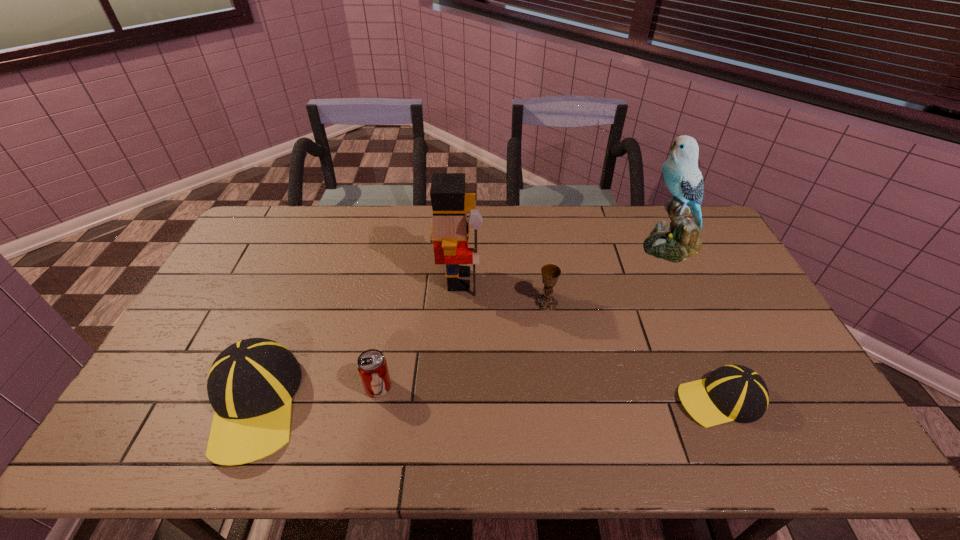
Find the location of a particular element. The width and height of the screenshot is (960, 540). spot to insert another baseball_cap for uniform distribution is located at coordinates (488, 402).